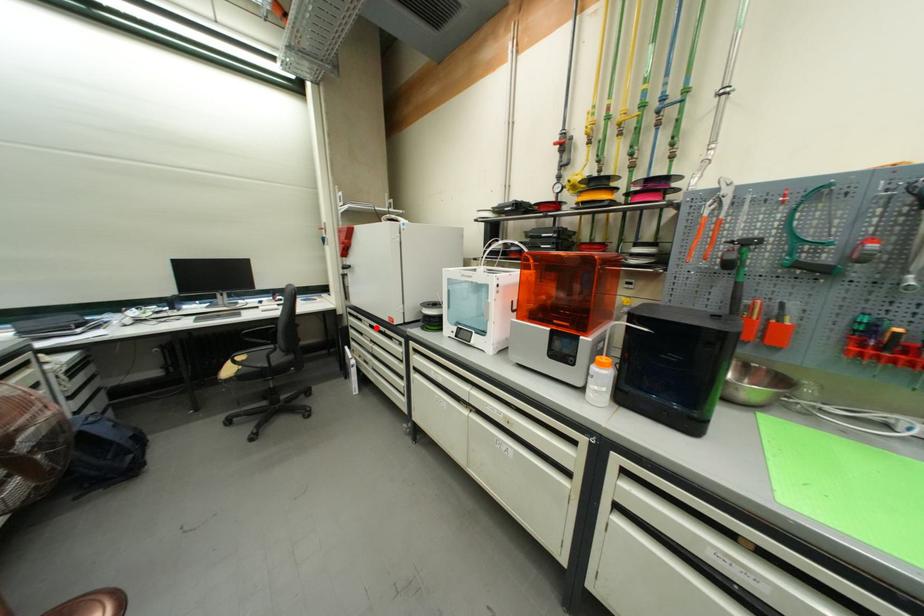
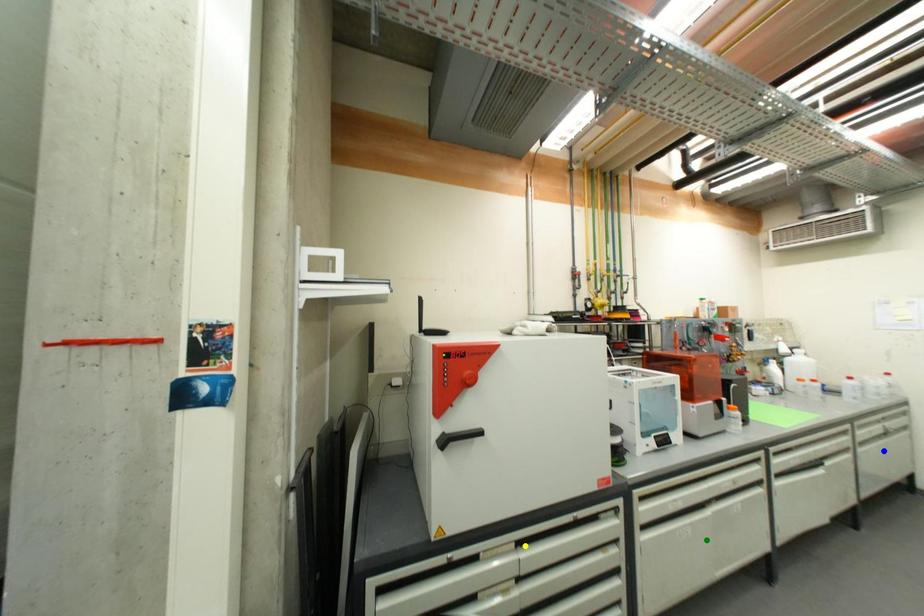
Question: I am providing you with two images of the same scene from different viewpoints. A red point is marked on the first image. You are given multiple points on the second image. Which mark in image 2 goes with the point in image 1?

Choices:
 (A) yellow point
 (B) blue point
 (C) green point

Answer: (A)